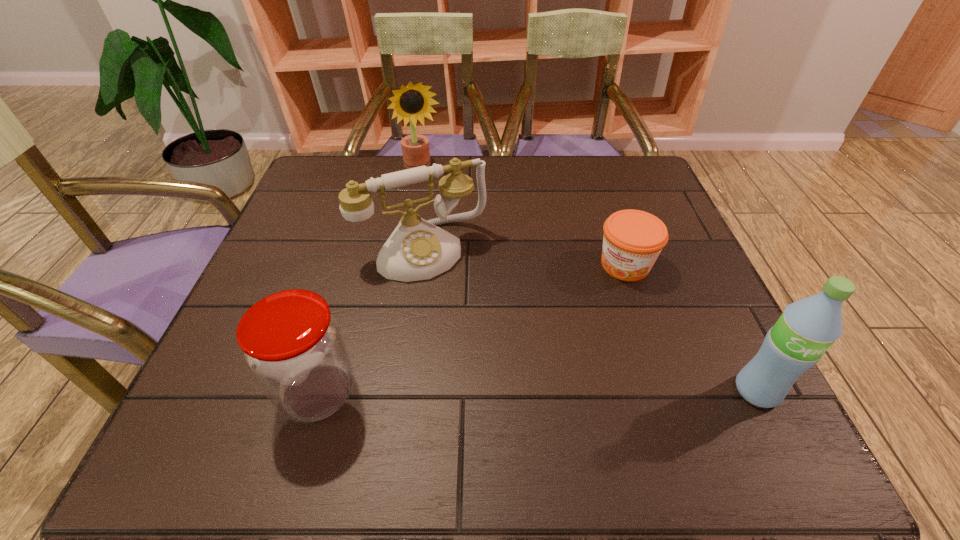
Locate an element on the screen. The image size is (960, 540). jar is located at coordinates (293, 345).

Find the location of a particular element. Image resolution: width=960 pixels, height=540 pixels. the rightmost object is located at coordinates (807, 328).

Image resolution: width=960 pixels, height=540 pixels. What are the coordinates of `the shortest object` in the screenshot? It's located at (633, 239).

Locate an element on the screen. Image resolution: width=960 pixels, height=540 pixels. the fourth object from left to right is located at coordinates (633, 239).

Locate an element on the screen. This screenshot has height=540, width=960. sunflower is located at coordinates (412, 102).

The height and width of the screenshot is (540, 960). I want to click on telephone, so click(x=417, y=249).

Where is `vacant space located 0.090m on the left of the jar`? This screenshot has width=960, height=540. vacant space located 0.090m on the left of the jar is located at coordinates (226, 393).

At what (x,y) coordinates should I click in order to perform the action: click on blank space located on the left of the rightmost object. Please return your answer as a coordinate pair (x, y). Looking at the image, I should click on (514, 391).

Locate an element on the screen. This screenshot has height=540, width=960. blank area located on the front label of the shortest object is located at coordinates (581, 322).

This screenshot has width=960, height=540. In order to click on free space located 0.070m on the front label of the shortest object in this screenshot , I will do `click(597, 301)`.